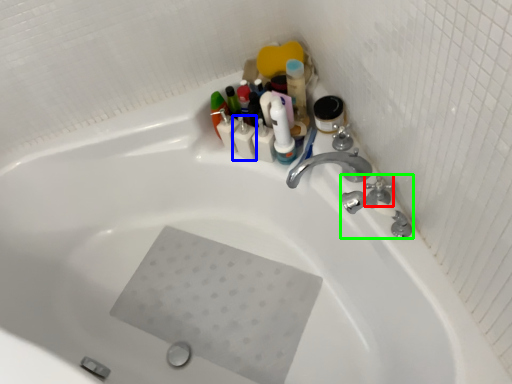
Question: Which is nearer to the plumbing fixture (highlighted by a red box)? toiletry (highlighted by a blue box) or plumbing fixture (highlighted by a green box).

Choices:
 (A) toiletry
 (B) plumbing fixture

Answer: (B)